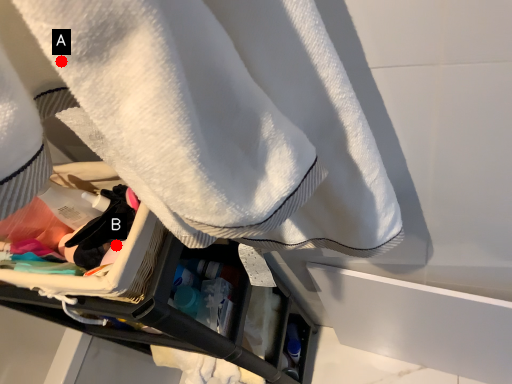
Question: Two points are circled on the image, labeled by A and B beside each circle. Which of the following is the closest to the observer?

Choices:
 (A) A is closer
 (B) B is closer

Answer: (A)